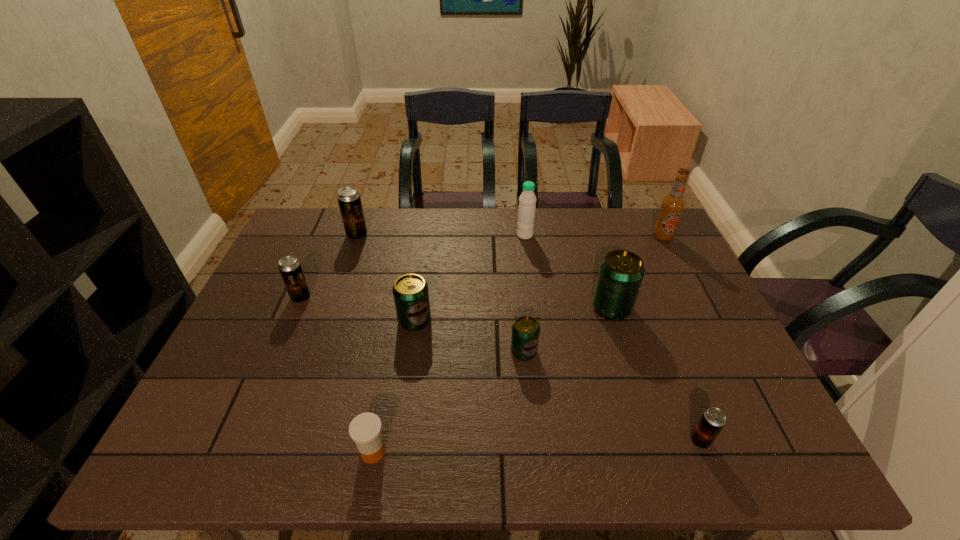
What are the coordinates of `object positioned at the left edge` in the screenshot? It's located at (290, 268).

Identify the location of beer bottle positioned at the right edge. (672, 206).

The height and width of the screenshot is (540, 960). I want to click on beer can positioned at the right edge, so click(x=713, y=419).

Find the location of a particular element. This screenshot has height=540, width=960. object that is positioned at the far right corner is located at coordinates (672, 206).

This screenshot has height=540, width=960. I want to click on object located at the near right corner, so click(713, 419).

What are the coordinates of `vacant position at the far edge of the desktop` in the screenshot? It's located at (445, 248).

Where is `free space at the near edge of the desktop`? The height and width of the screenshot is (540, 960). free space at the near edge of the desktop is located at coordinates (583, 441).

Find the location of a particular element. vacant space at the left edge is located at coordinates (268, 325).

Identify the location of vacant space at the right edge. (x=695, y=329).

Image resolution: width=960 pixels, height=540 pixels. I want to click on free point at the far right corner, so click(x=634, y=227).